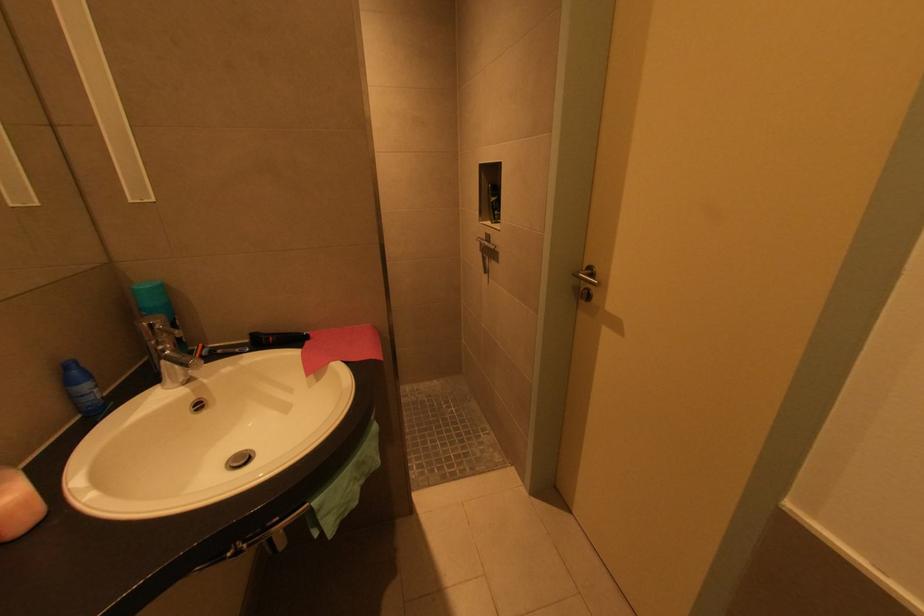
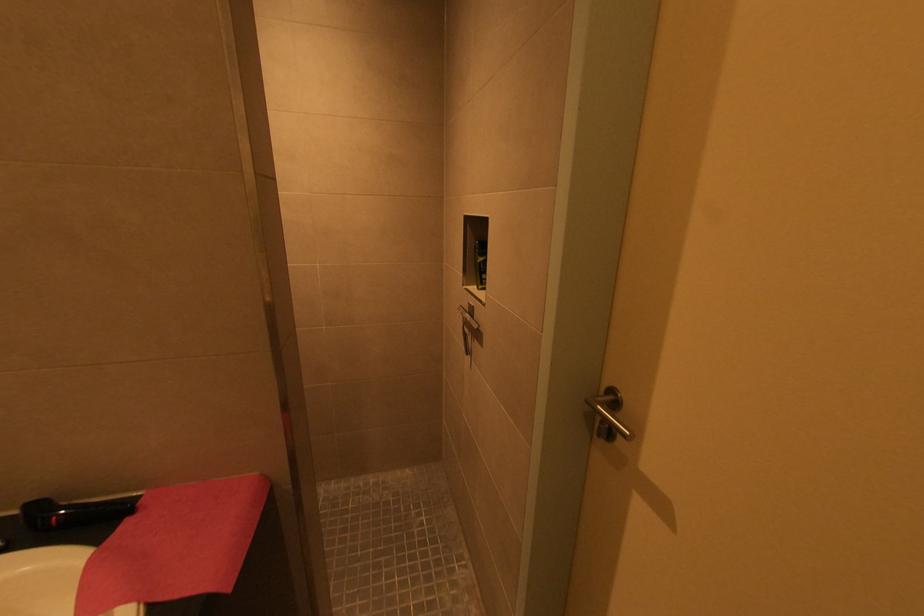
Question: How did the camera likely rotate?

Choices:
 (A) Left
 (B) Right
 (C) Up
 (D) Down

Answer: (C)